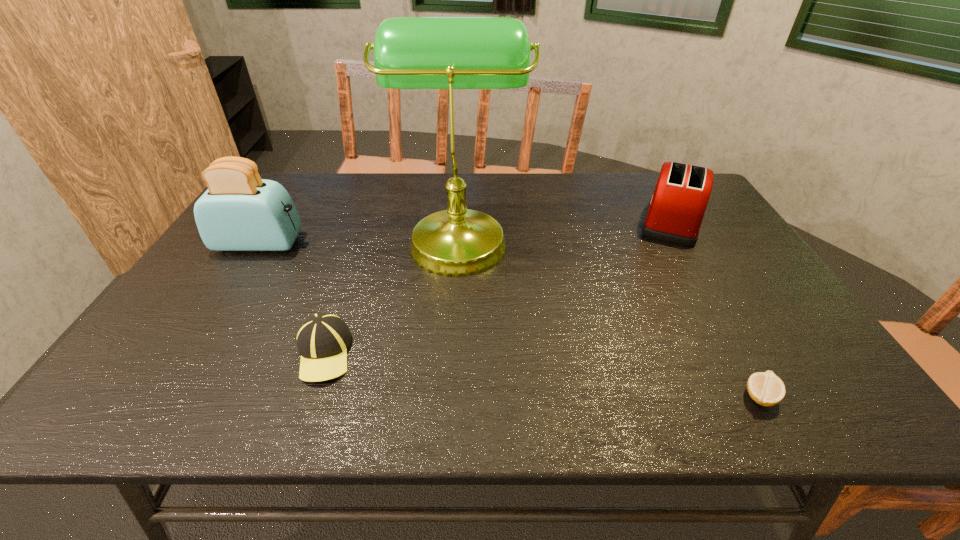
Find the location of `the third object from left to right`. the third object from left to right is located at coordinates (450, 53).

Locate an element on the screen. the tallest object is located at coordinates (450, 53).

The height and width of the screenshot is (540, 960). Find the location of `the leftmost object`. the leftmost object is located at coordinates (239, 211).

This screenshot has width=960, height=540. I want to click on the taller toaster, so click(x=239, y=211).

You are a GUI agent. You are given a task and a screenshot of the screen. Output one action in this format:
    pyautogui.click(x=<x>, y=<y>)
    Task: Click on the third tallest object
    The width and height of the screenshot is (960, 540).
    Given the screenshot: What is the action you would take?
    pyautogui.click(x=676, y=209)

Where is `the shorter toaster`? the shorter toaster is located at coordinates (676, 209).

Locate an element on the screen. The width and height of the screenshot is (960, 540). the second shortest object is located at coordinates (322, 340).

At what (x,y) coordinates should I click in order to perform the action: click on baseball cap. Please return your answer as a coordinate pair (x, y). The width and height of the screenshot is (960, 540). Looking at the image, I should click on (322, 340).

The height and width of the screenshot is (540, 960). I want to click on the shortest object, so click(x=765, y=388).

Locate an element on the screen. This screenshot has height=540, width=960. vacant area situated 0.200m on the desk next to the lamp is located at coordinates (594, 238).